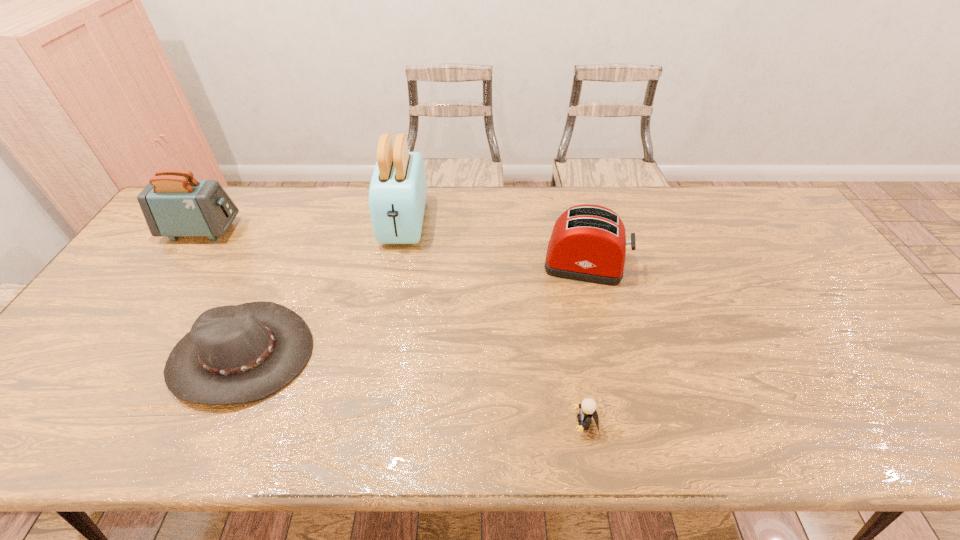
Where is `free space between the fourth shortest object and the third object from left to right`? The width and height of the screenshot is (960, 540). free space between the fourth shortest object and the third object from left to right is located at coordinates (302, 226).

Locate an element on the screen. The image size is (960, 540). vacant point located between the leftmost toaster and the Lego is located at coordinates (394, 327).

Locate an element on the screen. free space between the shortest object and the second object from left to right is located at coordinates (414, 389).

Where is `object that ranks as the fourth closest to the second toaster from right to left`? This screenshot has height=540, width=960. object that ranks as the fourth closest to the second toaster from right to left is located at coordinates (588, 406).

Where is `object that stands as the third closest to the tallest object`? object that stands as the third closest to the tallest object is located at coordinates (174, 204).

Locate an element on the screen. The image size is (960, 540). toaster that is the second closest to the second tallest object is located at coordinates (588, 243).

At what (x,y) coordinates should I click in order to perform the action: click on the closest toaster relative to the leftmost toaster. Please return your answer as a coordinate pair (x, y). The height and width of the screenshot is (540, 960). Looking at the image, I should click on (397, 194).

The width and height of the screenshot is (960, 540). What are the coordinates of `free location that satisfies the following two spatial constraints: 1. on the front-facing side of the shortest toaster; 2. on the left side of the second shortest toaster` in the screenshot? It's located at pos(179,264).

At what (x,y) coordinates should I click in order to perform the action: click on free space that satisfies the following two spatial constraints: 1. on the side of the tallest object with the lever; 2. on the front-facing side of the leftmost toaster. Please return your answer as a coordinate pair (x, y). Looking at the image, I should click on (402, 230).

You are a GUI agent. You are given a task and a screenshot of the screen. Output one action in this format:
    pyautogui.click(x=<x>, y=<y>)
    Task: Click on the vacant region that satisfies the following two spatial constraints: 1. on the side of the second toaster from left to right with the lever; 2. on the left side of the rightmost toaster
    
    Given the screenshot: What is the action you would take?
    pyautogui.click(x=396, y=264)